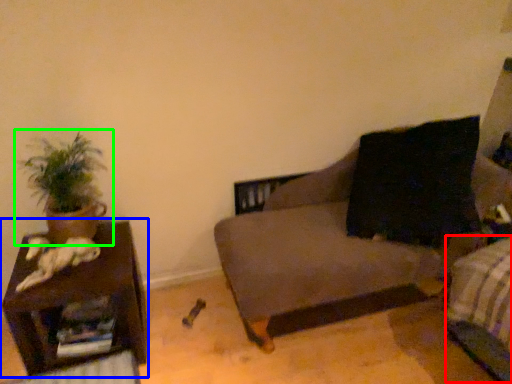
Question: Based on their relative distances, which object is farther from bed frame (highlighted by a red box)? Choose from furniture (highlighted by a blue box) and houseplant (highlighted by a green box).

Choices:
 (A) furniture
 (B) houseplant

Answer: (B)